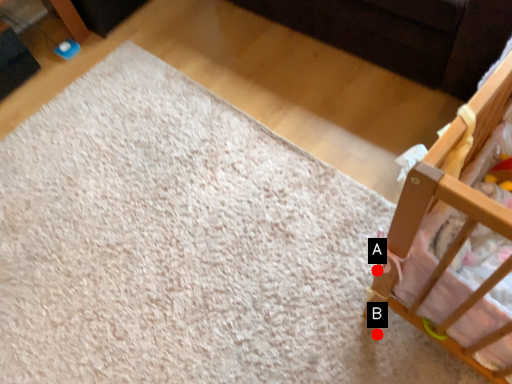
Question: Two points are circled on the image, labeled by A and B beside each circle. Which point appears farthest from the camera in this image?

Choices:
 (A) A is further
 (B) B is further

Answer: (A)